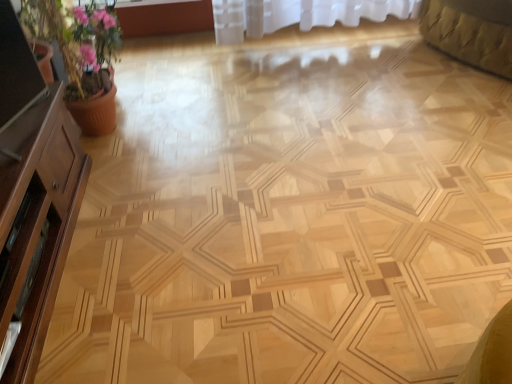
Question: Do you think brown wood dresser at left is within pink clay pot at left, or outside of it?

Choices:
 (A) outside
 (B) inside

Answer: (A)

Question: In terms of height, does brown wood dresser at left look taller or shorter compared to pink clay pot at left?

Choices:
 (A) tall
 (B) short

Answer: (B)

Question: Estimate the real-world distances between objects in this image. Which object is farther from the brown wood dresser at left?

Choices:
 (A) pink clay pot at left
 (B) matte wooden screen door at left

Answer: (A)

Question: Considering the real-world distances, which object is farthest from the pink clay pot at left?

Choices:
 (A) brown wood dresser at left
 (B) matte wooden screen door at left

Answer: (B)